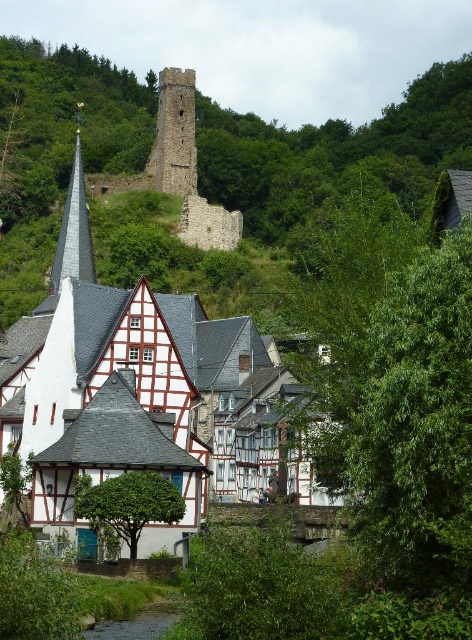
You are standing in the village scene and want to determine which of the two points, point (84, 449) or point (237, 220), is closer to you. Based on the scene description, which point is nearer?

Point (84, 449) is closer to the camera than point (237, 220).